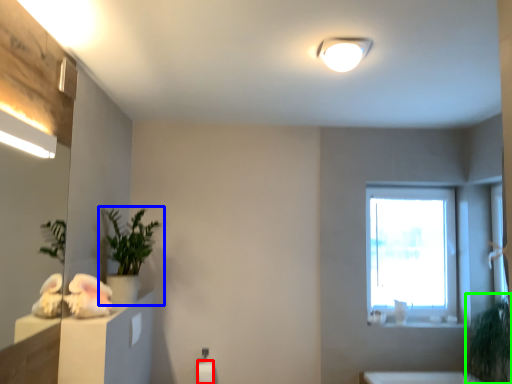
Question: Based on their relative distances, which object is farther from toilet paper (highlighted by a red box)? Choose from houseplant (highlighted by a blue box) and plant (highlighted by a green box).

Choices:
 (A) houseplant
 (B) plant

Answer: (B)